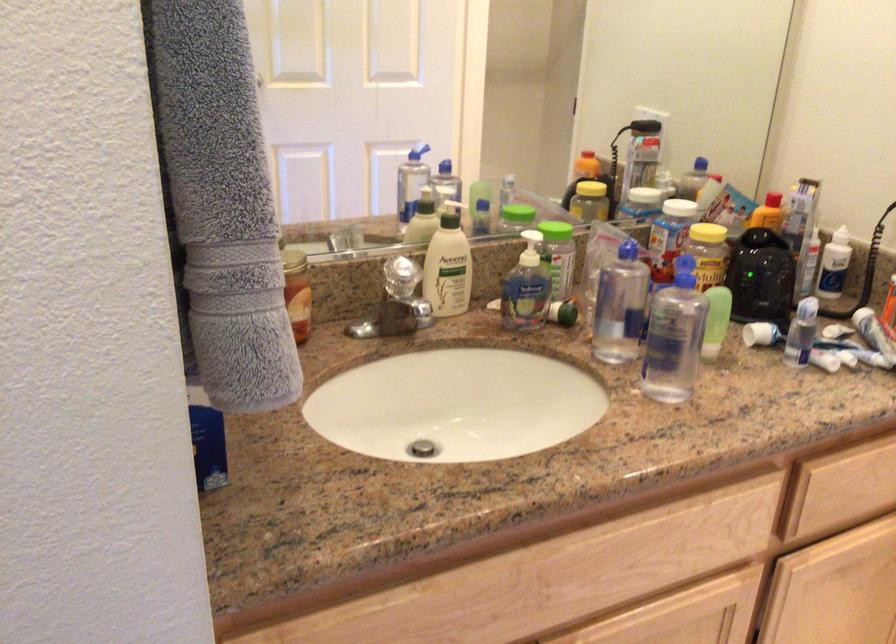
What do you see at coordinates (448, 265) in the screenshot?
I see `the green soap pump` at bounding box center [448, 265].